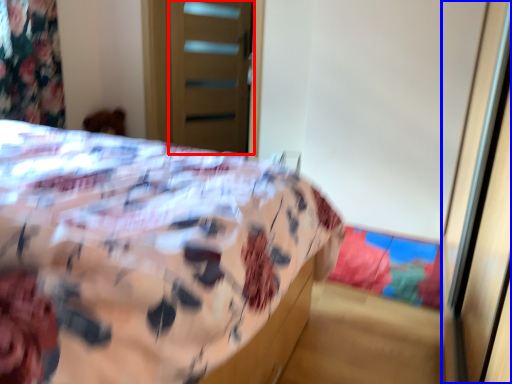
Question: Which of the following is the closest to the observer, screen door (highlighted by a red box) or screen door (highlighted by a blue box)?

Choices:
 (A) screen door
 (B) screen door

Answer: (B)